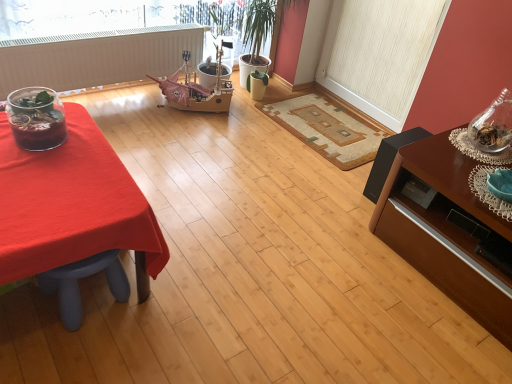
Question: Is white matte radiator at upper left facing towards white textured screen door at upper right?

Choices:
 (A) yes
 (B) no

Answer: (B)

Question: Is white matte radiator at upper left in front of white textured screen door at upper right?

Choices:
 (A) no
 (B) yes

Answer: (B)

Question: From the image's perspective, would you say white matte radiator at upper left is shown under white textured screen door at upper right?

Choices:
 (A) no
 (B) yes

Answer: (B)

Question: Is white matte radiator at upper left wider than white textured screen door at upper right?

Choices:
 (A) yes
 (B) no

Answer: (A)

Question: Is white matte radiator at upper left not within white textured screen door at upper right?

Choices:
 (A) no
 (B) yes

Answer: (B)

Question: From their relative heights in the image, would you say smooth red tablecloth at left is taller or shorter than brown wood table at right?

Choices:
 (A) short
 (B) tall

Answer: (A)

Question: In terms of size, does smooth red tablecloth at left appear bigger or smaller than brown wood table at right?

Choices:
 (A) small
 (B) big

Answer: (A)

Question: Based on their positions, is smooth red tablecloth at left located to the left or right of brown wood table at right?

Choices:
 (A) left
 (B) right

Answer: (A)

Question: In the image, is smooth red tablecloth at left positioned in front of or behind brown wood table at right?

Choices:
 (A) front
 (B) behind

Answer: (A)

Question: Considering the positions of point (26, 196) and point (386, 109), is point (26, 196) closer or farther from the camera than point (386, 109)?

Choices:
 (A) closer
 (B) farther

Answer: (A)

Question: Considering their positions, is smooth red tablecloth at left located in front of or behind white textured screen door at upper right?

Choices:
 (A) front
 (B) behind

Answer: (A)

Question: In the image, is smooth red tablecloth at left on the left side or the right side of white textured screen door at upper right?

Choices:
 (A) right
 (B) left

Answer: (B)

Question: From the image's perspective, relative to white textured screen door at upper right, is smooth red tablecloth at left above or below?

Choices:
 (A) above
 (B) below

Answer: (B)

Question: Is clear glass jar at right to the left or to the right of translucent glass terrarium at left in the image?

Choices:
 (A) left
 (B) right

Answer: (B)

Question: From the image's perspective, relative to translucent glass terrarium at left, is clear glass jar at right above or below?

Choices:
 (A) below
 (B) above

Answer: (B)